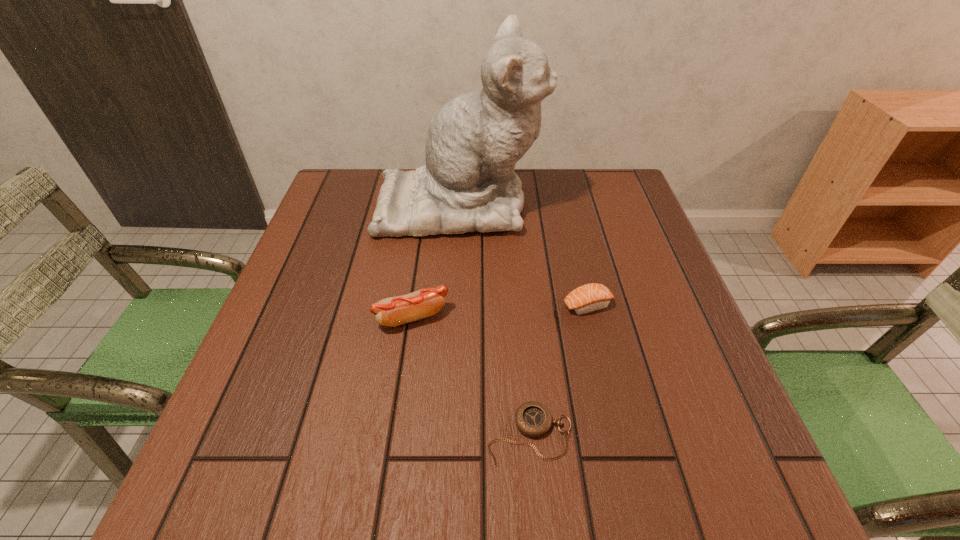
Find the location of a particular element. the tallest object is located at coordinates (474, 141).

Image resolution: width=960 pixels, height=540 pixels. I want to click on cat, so click(474, 141).

The image size is (960, 540). What are the coordinates of `the third shortest object` in the screenshot? It's located at (393, 311).

This screenshot has height=540, width=960. In order to click on the third tallest object in this screenshot , I will do (592, 297).

The height and width of the screenshot is (540, 960). Identify the location of sushi. (592, 297).

Where is `the shortest object`? The image size is (960, 540). the shortest object is located at coordinates (533, 419).

The image size is (960, 540). I want to click on pocket watch, so click(533, 419).

Image resolution: width=960 pixels, height=540 pixels. Identify the location of vacant region located 0.130m on the front-facing side of the cat. (589, 203).

Where is `vacant space located on the back of the third shortest object`? The height and width of the screenshot is (540, 960). vacant space located on the back of the third shortest object is located at coordinates (427, 214).

Where is `free spot located 0.070m on the left of the rightmost object`? free spot located 0.070m on the left of the rightmost object is located at coordinates (530, 305).